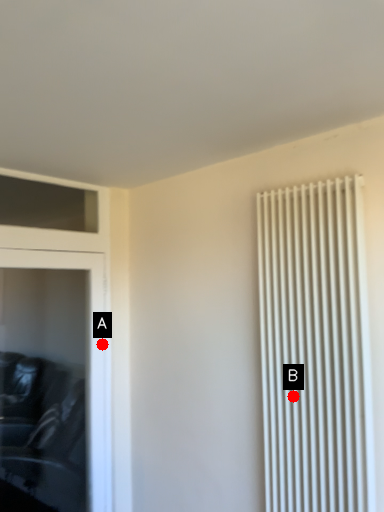
Question: Two points are circled on the image, labeled by A and B beside each circle. Which point is closer to the camera?

Choices:
 (A) A is closer
 (B) B is closer

Answer: (B)